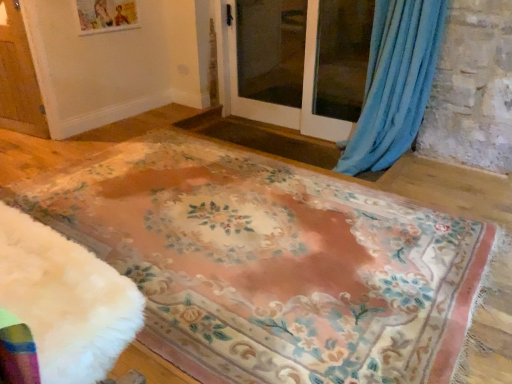
Question: From the image's perspective, is floral-patterned carpet at center over wooden screen door at left, placed as the first screen door when sorted from left to right?

Choices:
 (A) yes
 (B) no

Answer: (B)

Question: Would you say floral-patterned carpet at center is a long distance from wooden screen door at left, arranged as the 3th screen door when viewed from the right?

Choices:
 (A) yes
 (B) no

Answer: (A)

Question: Is floral-patterned carpet at center shorter than wooden screen door at left, arranged as the 3th screen door when viewed from the right?

Choices:
 (A) no
 (B) yes

Answer: (B)

Question: From a real-world perspective, is floral-patterned carpet at center physically above wooden screen door at left, arranged as the 3th screen door when viewed from the right?

Choices:
 (A) yes
 (B) no

Answer: (B)

Question: Is floral-patterned carpet at center surrounding wooden screen door at left, placed as the first screen door when sorted from left to right?

Choices:
 (A) no
 (B) yes

Answer: (A)

Question: Is floral-patterned carpet at center bigger or smaller than transparent glass screen door at center, placed as the third screen door when sorted from left to right?

Choices:
 (A) big
 (B) small

Answer: (A)

Question: From the image's perspective, is floral-patterned carpet at center above or below transparent glass screen door at center, placed as the 1th screen door when sorted from right to left?

Choices:
 (A) below
 (B) above

Answer: (A)

Question: From a real-world perspective, is floral-patterned carpet at center above or below transparent glass screen door at center, placed as the third screen door when sorted from left to right?

Choices:
 (A) above
 (B) below

Answer: (B)

Question: Is floral-patterned carpet at center in front of or behind transparent glass screen door at center, placed as the third screen door when sorted from left to right, in the image?

Choices:
 (A) front
 (B) behind

Answer: (A)

Question: Based on their sizes in the image, would you say wooden screen door at left, arranged as the 3th screen door when viewed from the right, is bigger or smaller than blue soft fabric curtain at upper right?

Choices:
 (A) big
 (B) small

Answer: (A)

Question: From the image's perspective, is wooden screen door at left, placed as the first screen door when sorted from left to right, located above or below blue soft fabric curtain at upper right?

Choices:
 (A) above
 (B) below

Answer: (A)

Question: From a real-world perspective, is wooden screen door at left, arranged as the 3th screen door when viewed from the right, positioned above or below blue soft fabric curtain at upper right?

Choices:
 (A) above
 (B) below

Answer: (A)

Question: In terms of height, does wooden screen door at left, placed as the first screen door when sorted from left to right, look taller or shorter compared to blue soft fabric curtain at upper right?

Choices:
 (A) short
 (B) tall

Answer: (A)

Question: From their relative heights in the image, would you say wooden screen door at left, arranged as the 3th screen door when viewed from the right, is taller or shorter than transparent glass screen door at center, placed as the third screen door when sorted from left to right?

Choices:
 (A) tall
 (B) short

Answer: (B)

Question: Relative to transparent glass screen door at center, placed as the third screen door when sorted from left to right, is wooden screen door at left, arranged as the 3th screen door when viewed from the right, in front or behind?

Choices:
 (A) behind
 (B) front

Answer: (A)